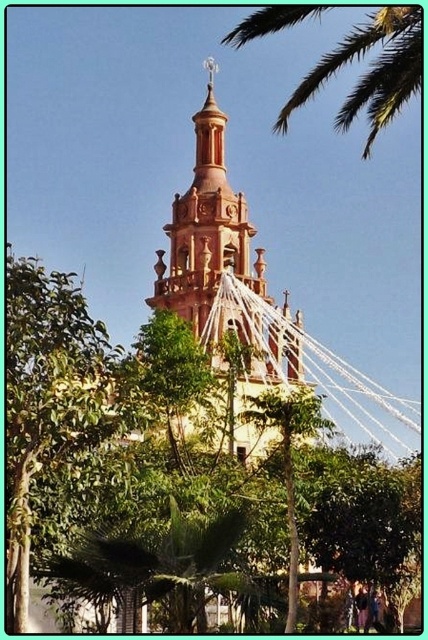
Question: Among these objects, which one is farthest from the camera?

Choices:
 (A) green leafy tree at center
 (B) terracotta stucco church tower at center
 (C) green leafy palm at upper right
 (D) green leafy palm tree at center

Answer: (B)

Question: Which object appears farthest from the camera in this image?

Choices:
 (A) green leafy tree at center
 (B) green leafy palm at upper right
 (C) green leafy palm tree at center

Answer: (C)

Question: Among these points, which one is farthest from the camera?

Choices:
 (A) (255, 397)
 (B) (282, 28)
 (C) (181, 266)
 (D) (252, 333)

Answer: (C)

Question: In this image, where is green leafy tree at center located relative to green leafy palm tree at center?

Choices:
 (A) left
 (B) right

Answer: (A)

Question: Can you confirm if green leafy tree at center is thinner than green leafy palm tree at center?

Choices:
 (A) no
 (B) yes

Answer: (A)

Question: Is green leafy tree at center to the left of green leafy palm at upper right from the viewer's perspective?

Choices:
 (A) yes
 (B) no

Answer: (A)